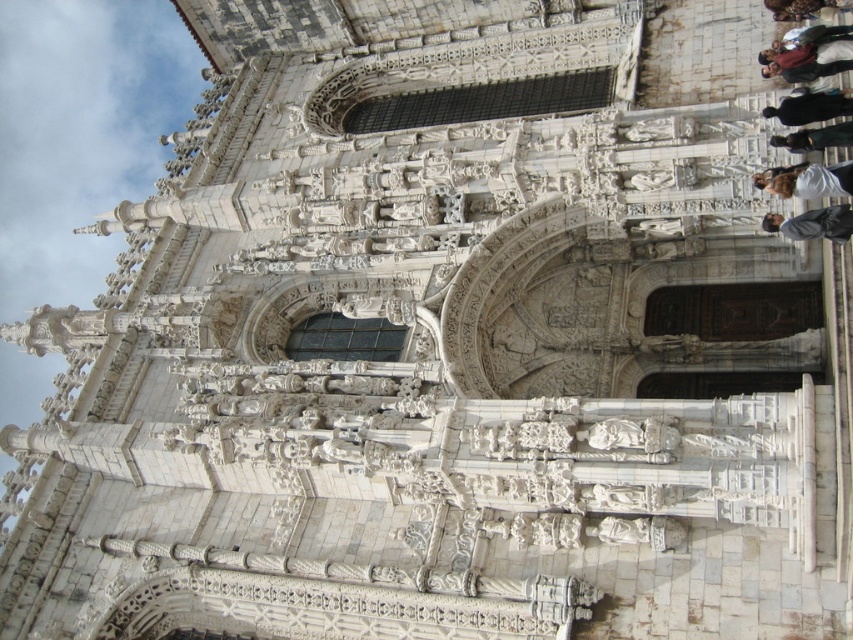
Question: Is dark brown leather jacket at upper right further to the viewer compared to black fabric person at upper right?

Choices:
 (A) yes
 (B) no

Answer: (A)

Question: Is white fabric at upper right above black fabric person at upper right?

Choices:
 (A) yes
 (B) no

Answer: (B)

Question: Among these objects, which one is farthest from the camera?

Choices:
 (A) white fabric at upper right
 (B) black fabric person at upper right
 (C) dark gray suit at center

Answer: (B)

Question: In this image, where is white fabric at upper right located relative to black leather jacket at upper right?

Choices:
 (A) right
 (B) left

Answer: (B)

Question: Estimate the real-world distances between objects in this image. Which object is closer to the dark brown leather jacket at upper right?

Choices:
 (A) black leather jacket at upper right
 (B) black fabric person at upper right
 (C) dark gray suit at center

Answer: (B)

Question: Which object appears farthest from the camera in this image?

Choices:
 (A) white fabric at upper right
 (B) black fabric person at upper right

Answer: (B)